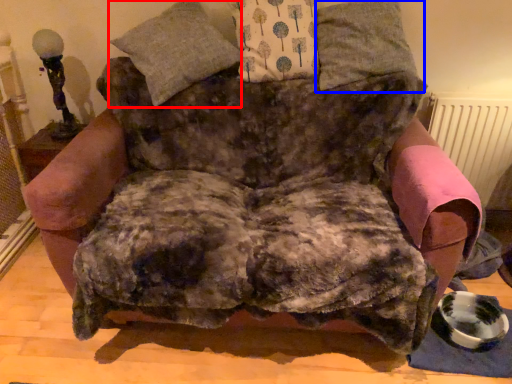
Question: Which point is further to the camera, pillow (highlighted by a red box) or pillow (highlighted by a blue box)?

Choices:
 (A) pillow
 (B) pillow

Answer: (B)